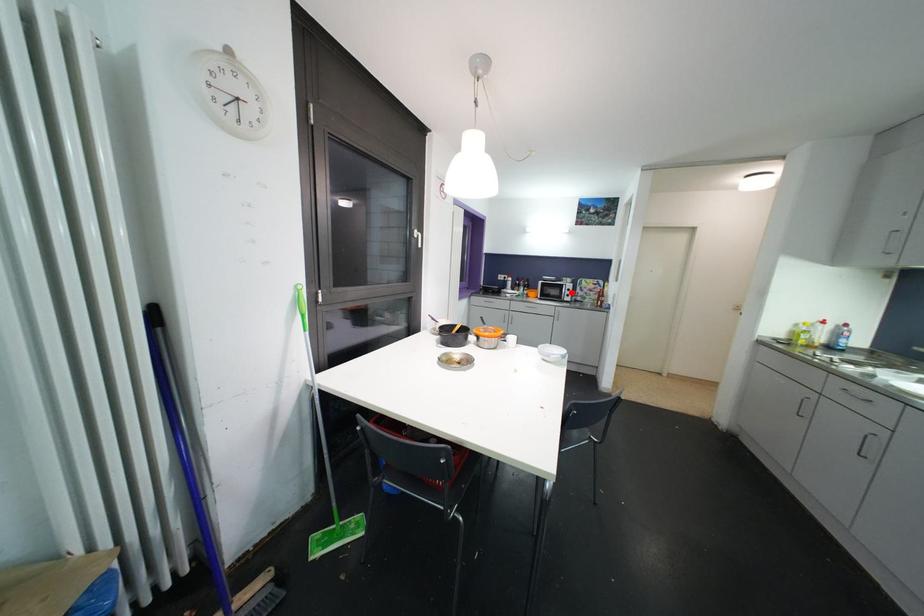
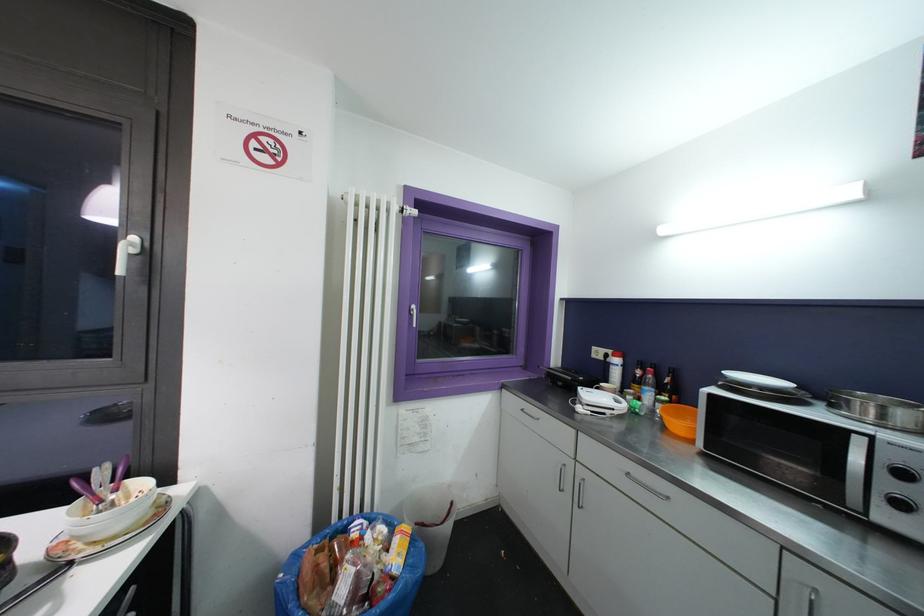
Where in the second image is the point corresponding to the highlighted location from the first image?

(906, 477)